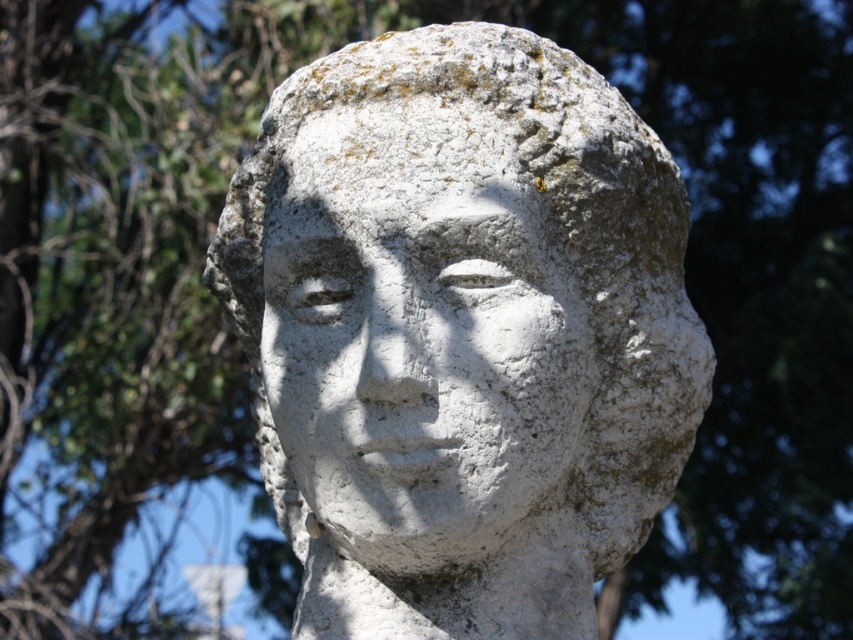
Between white stone bust at center and white stone face at center, which one is positioned lower?

white stone bust at center

Who is positioned more to the right, white stone bust at center or white stone face at center?

white stone face at center is more to the right.

Describe the element at coordinates (461, 332) in the screenshot. I see `white stone bust at center` at that location.

Find the location of a particular element. The width and height of the screenshot is (853, 640). white stone bust at center is located at coordinates (461, 332).